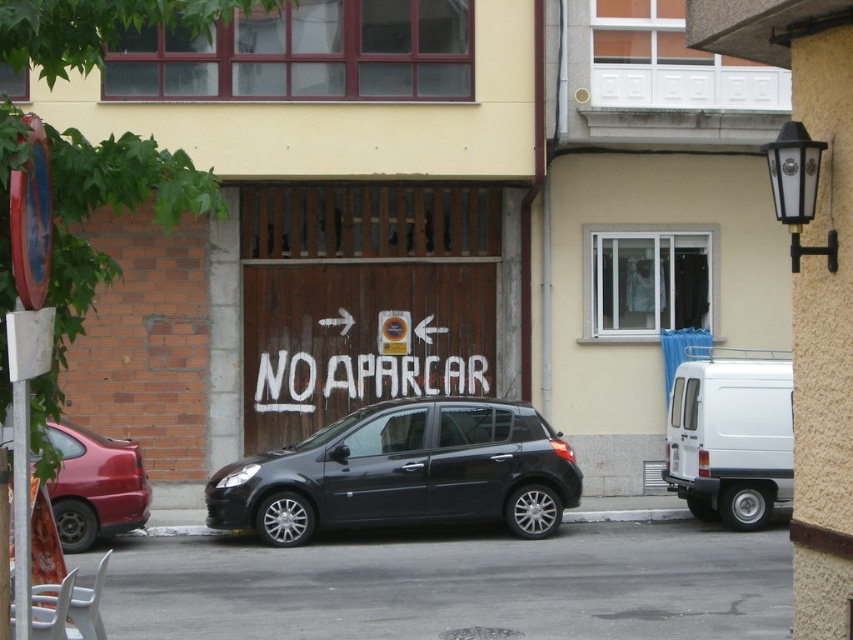
Does black metallic car at center appear over metallic red car at left?

Incorrect, black metallic car at center is not positioned above metallic red car at left.

Between point (373, 513) and point (80, 550), which one is positioned behind?

Positioned behind is point (373, 513).

I want to click on black metallic car at center, so click(x=404, y=472).

Looking at this image, is black metallic car at center thinner than white matte van at right?

No, black metallic car at center is not thinner than white matte van at right.

Consider the image. Between black metallic car at center and white matte van at right, which one has more height?

white matte van at right

Is point (451, 397) closer to viewer compared to point (779, 424)?

Yes.

Identify the location of black metallic car at center. (404, 472).

Can you confirm if white matte van at right is bigger than metallic red car at left?

Indeed, white matte van at right has a larger size compared to metallic red car at left.

Does point (691, 502) come closer to viewer compared to point (51, 444)?

No, (691, 502) is further to viewer.

Identify the location of white matte van at right. (730, 436).